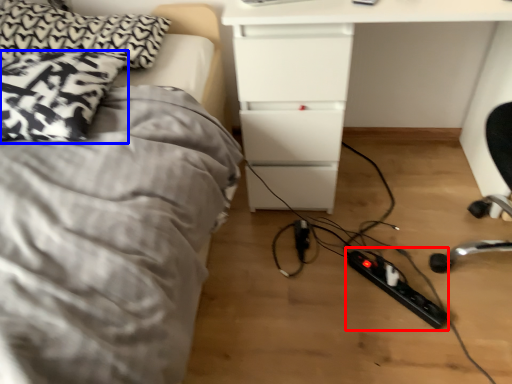
Question: Which object appears farthest to the camera in this image, extension cord (highlighted by a red box) or pillow (highlighted by a blue box)?

Choices:
 (A) extension cord
 (B) pillow

Answer: (A)